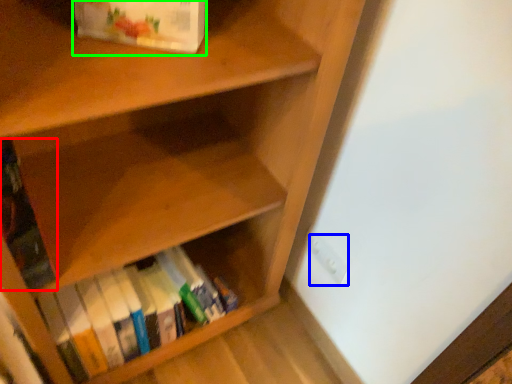
Question: Which object is the farthest from book (highlighted by a red box)? Choose among these: electric outlet (highlighted by a blue box) or book (highlighted by a green box).

Choices:
 (A) electric outlet
 (B) book

Answer: (A)